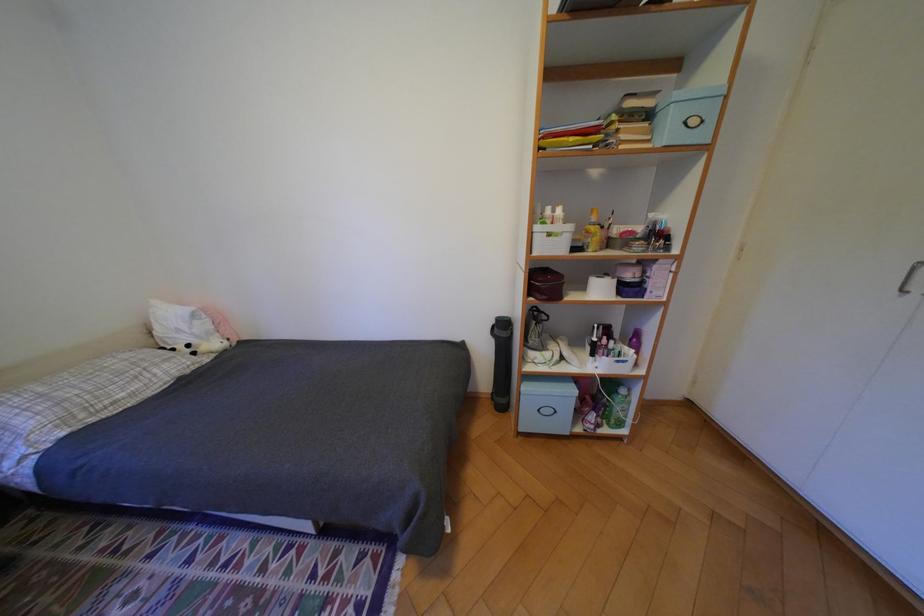
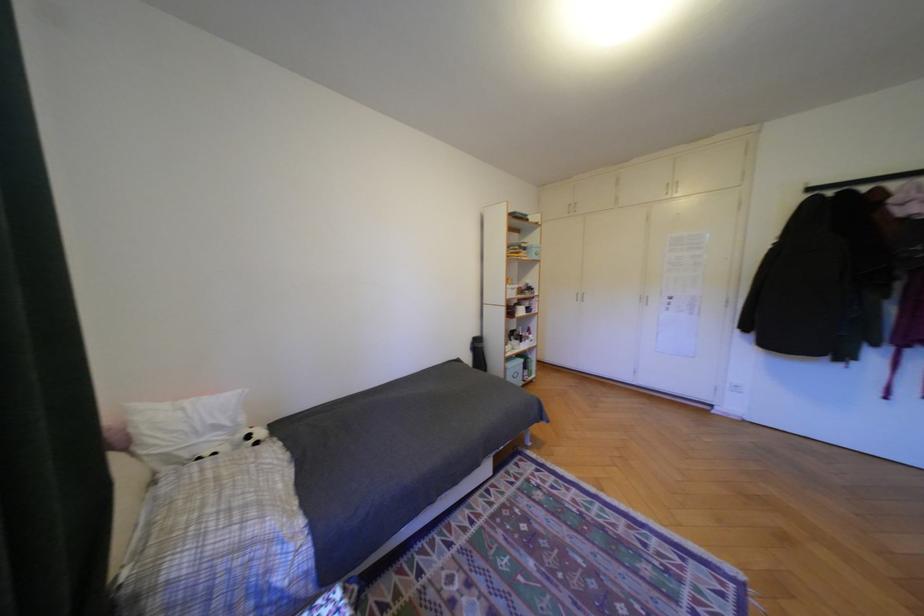
In the second image, find the point that corresponds to (x=201, y=346) in the first image.

(261, 437)